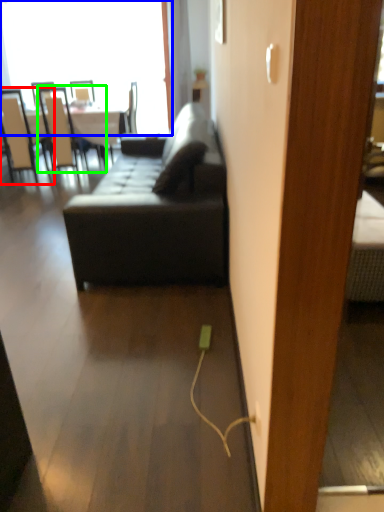
Question: Which is nearer to the chair (highlighted by a red box)? window (highlighted by a blue box) or chair (highlighted by a green box).

Choices:
 (A) window
 (B) chair

Answer: (B)